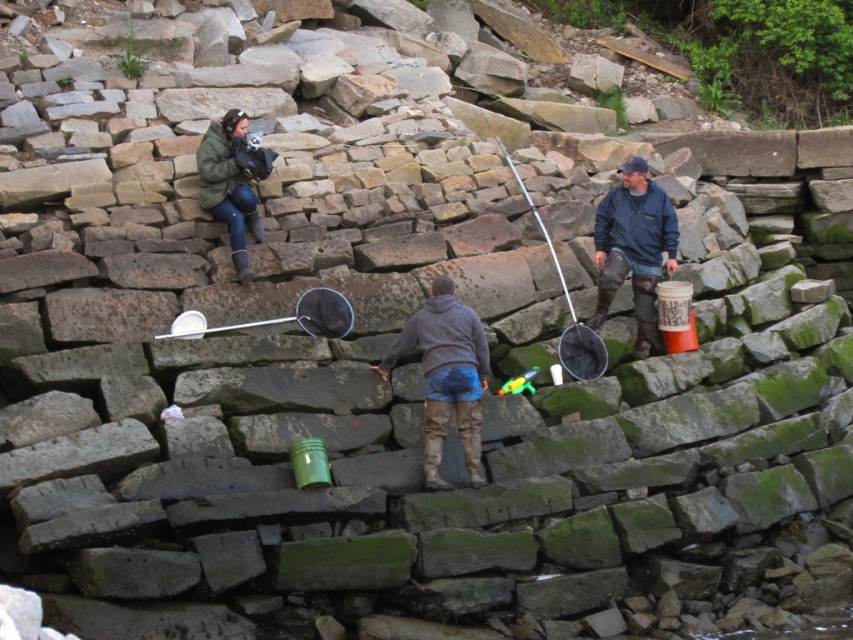
You are a hiker who just arrived at the rocky shoreline. You see a blue fleece jacket at center and a green matte jacket at upper left. Which jacket is closer to the right side of the scene?

The blue fleece jacket at center is to the right of the green matte jacket at upper left, so the blue fleece jacket at center is closer to the right side of the scene.

From the picture: You are planning to take a group photo of the two people in the rocky shoreline scene. You need to ensure that both the blue fleece jacket at center and the green matte jacket at upper left are clearly visible. Based on their sizes, which jacket should be placed closer to the camera to maintain similar apparent sizes in the photo?

The blue fleece jacket at center is smaller than the green matte jacket at upper left. To make them appear similar in size in the photo, the smaller blue fleece jacket at center should be placed closer to the camera while the larger green matte jacket at upper left should be positioned further back.

You are standing at the point marked by the coordinates (445, 376) in the image. What object is directly beneath your feet?

The point at coordinates (445, 376) is located on the gray fleece jacket at center.